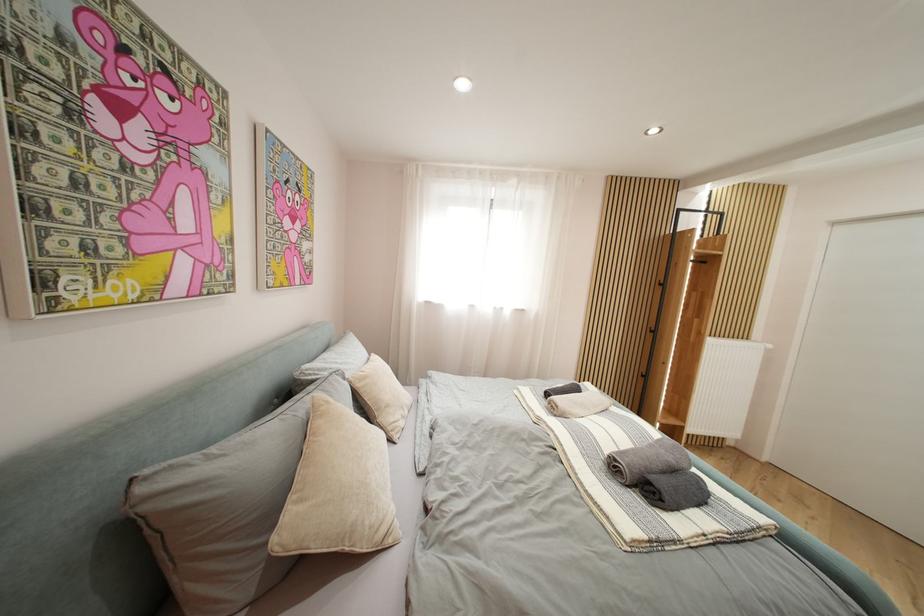
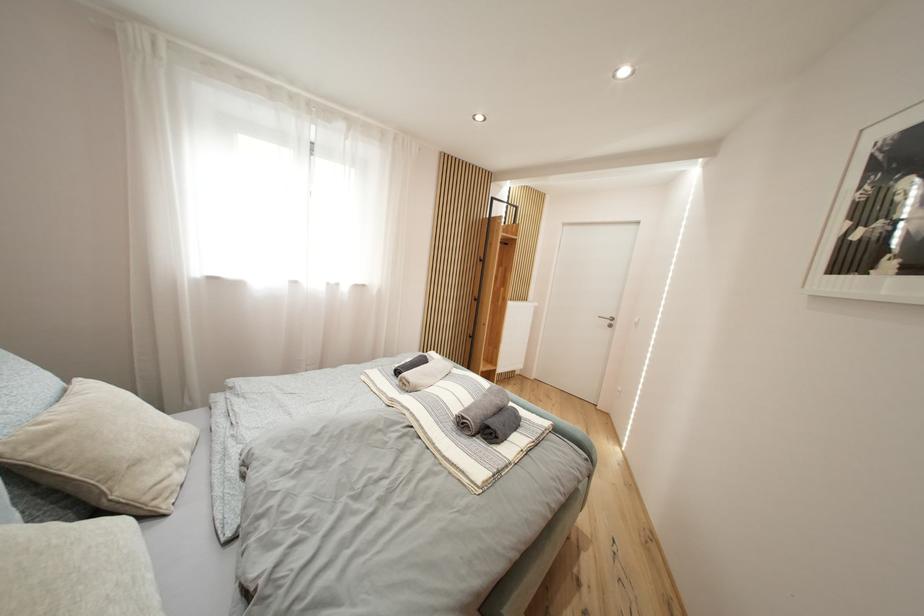
Question: The camera is either moving clockwise (left) or counter-clockwise (right) around the object. The first image is from the beginning of the video and the second image is from the end. Is the camera moving left or right when shooting the video?

Choices:
 (A) Left
 (B) Right

Answer: (A)